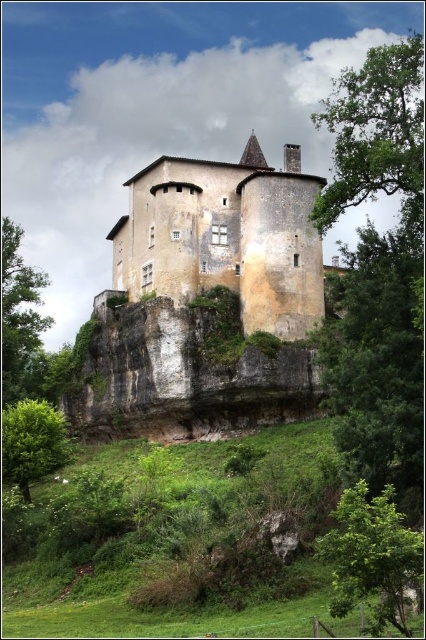
You are a bird looking for a place to perch. You see two green leafy trees in the scene. Which tree, the green leafy tree at center or the green leafy tree at lower right, is taller and thus better for a high vantage point?

The green leafy tree at center is taller than the green leafy tree at lower right, so it would provide a better high vantage point.

You are an archer positioned at the base of the castle, aiming to shoot an arrow towards the green leafy tree at center and the green leafy tree at lower right. Which tree should you aim for if you want to hit the wider target?

The green leafy tree at center has a larger width than the green leafy tree at lower right, so you should aim for the green leafy tree at center to hit the wider target.